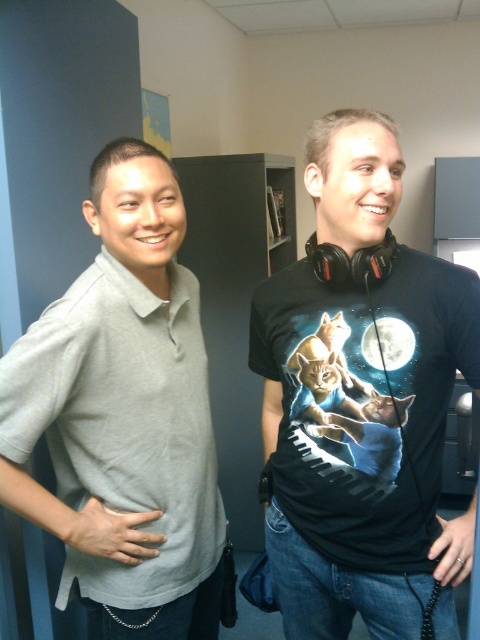
Who is higher up, black matte t-shirt at center or light gray cotton polo shirt at left?

black matte t-shirt at center is above.

Does black matte t-shirt at center appear on the right side of light gray cotton polo shirt at left?

Yes, black matte t-shirt at center is to the right of light gray cotton polo shirt at left.

Which is in front, point (264, 401) or point (123, 536)?

Positioned in front is point (123, 536).

Where is `black matte t-shirt at center`? The height and width of the screenshot is (640, 480). black matte t-shirt at center is located at coordinates (362, 444).